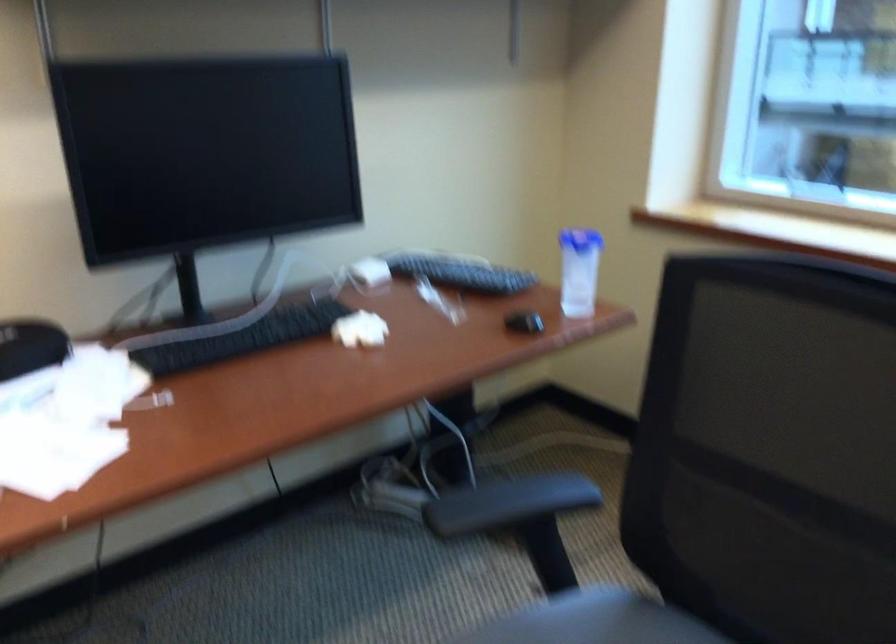
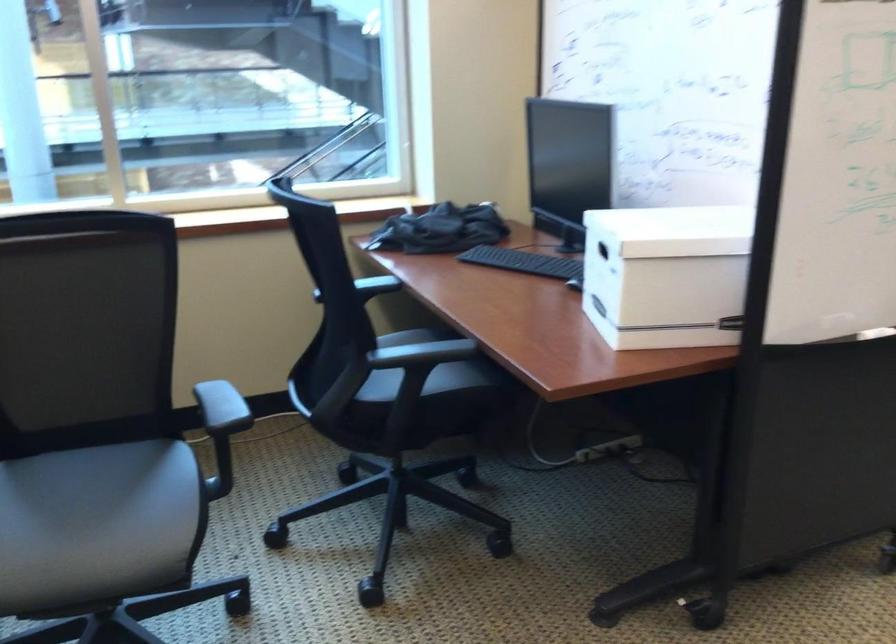
Question: The images are taken continuously from a first-person perspective. In which direction is your viewpoint rotating?

Choices:
 (A) Left
 (B) Right
 (C) Up
 (D) Down

Answer: (B)